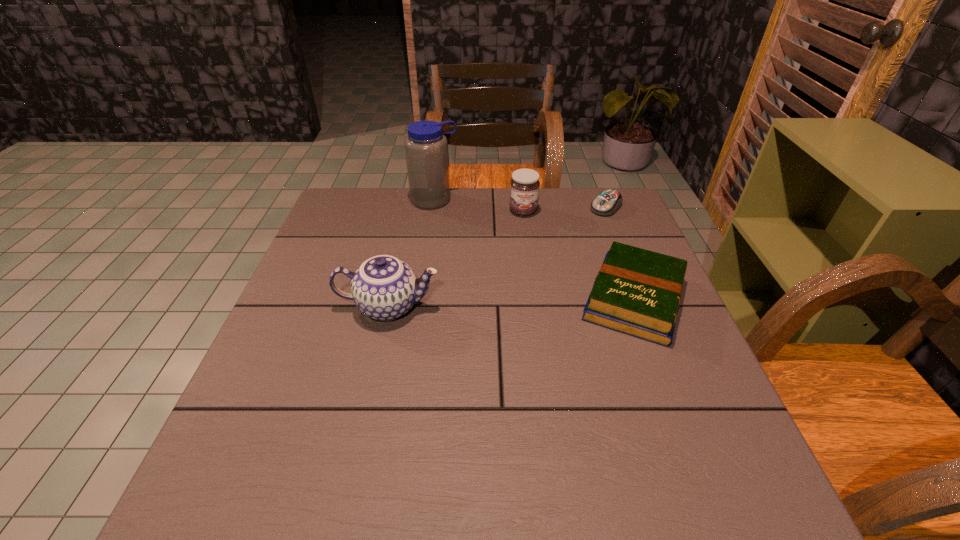
Locate an element on the screen. object present at the left edge is located at coordinates (384, 288).

I want to click on book situated at the right edge, so (638, 292).

Locate an element on the screen. computer mouse present at the right edge is located at coordinates (607, 202).

Locate an element on the screen. object that is positioned at the far right corner is located at coordinates (607, 202).

Where is `vacant space at the far edge`? vacant space at the far edge is located at coordinates point(517,223).

At what (x,y) coordinates should I click in order to perform the action: click on vacant space at the near edge of the desktop. Please return your answer as a coordinate pair (x, y). This screenshot has width=960, height=540. Looking at the image, I should click on (420, 416).

Find the location of a particular element. vacant position at the left edge of the desktop is located at coordinates (349, 304).

At what (x,y) coordinates should I click in order to perform the action: click on vacant space at the right edge. Please return your answer as a coordinate pair (x, y). Looking at the image, I should click on (674, 378).

Locate an element on the screen. The height and width of the screenshot is (540, 960). vacant space at the far left corner is located at coordinates (367, 200).

The image size is (960, 540). Identify the location of vacant space at the near left corner of the desktop. (267, 430).